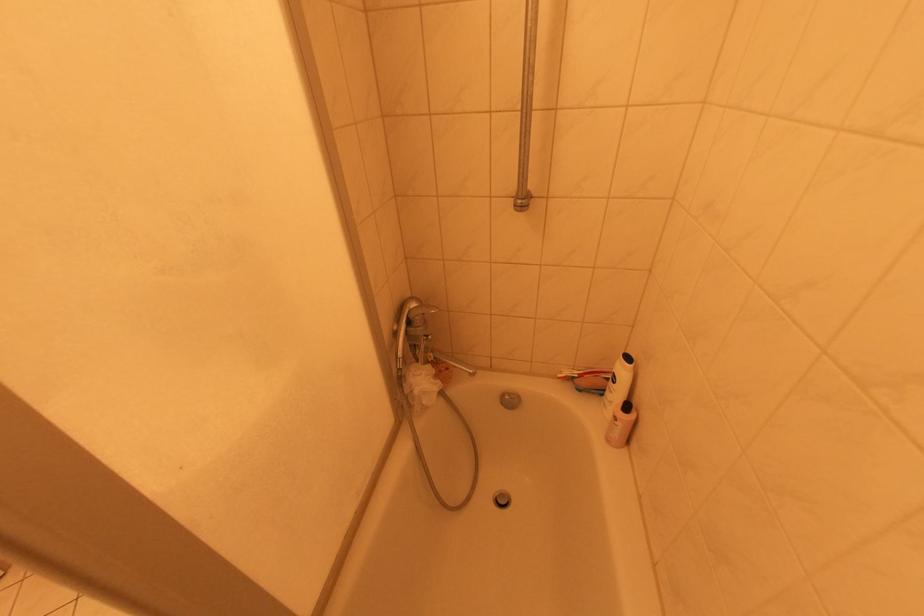
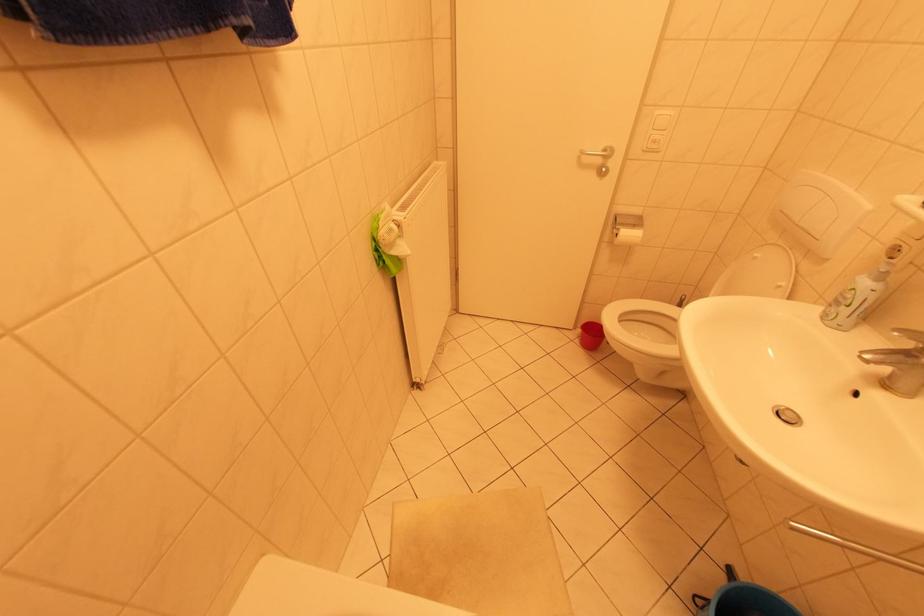
How did the camera likely rotate?

The camera's rotation is toward left-down.